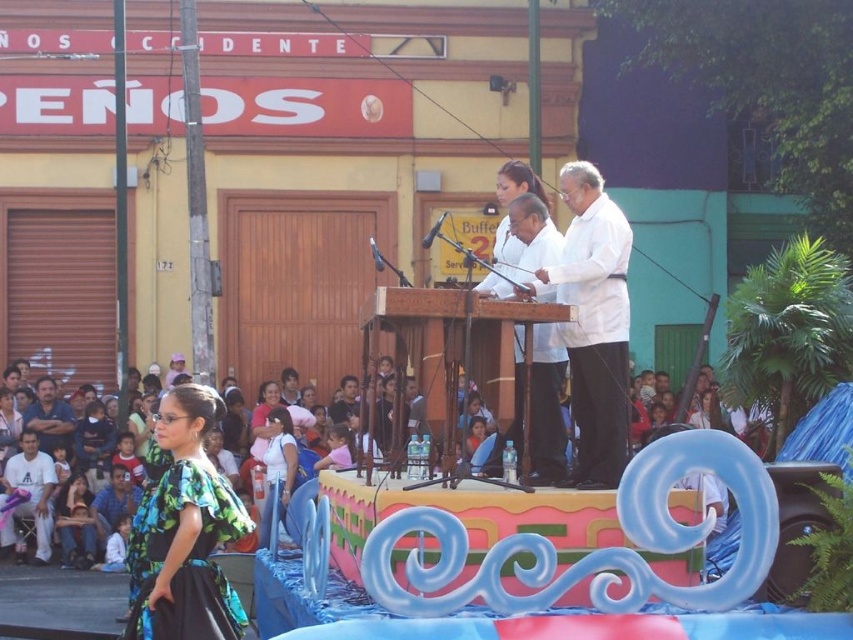
The width and height of the screenshot is (853, 640). Identify the location of floral dress at lower left. 76,525.

Looking at this image, who is taller, floral dress at lower left or dark brown leather jacket at lower left?

floral dress at lower left is taller.

What do you see at coordinates (76, 525) in the screenshot? I see `floral dress at lower left` at bounding box center [76, 525].

The image size is (853, 640). In order to click on floral dress at lower left in this screenshot , I will do `click(76, 525)`.

Is the position of matte white blouse at center more distant than that of white cotton shirt at center?

That is False.

Is point (492, 285) farther from viewer compared to point (267, 493)?

No, it is not.

This screenshot has height=640, width=853. What are the coordinates of `matte white blouse at center` in the screenshot? It's located at (546, 412).

Does point (152, 576) come closer to viewer compared to point (350, 509)?

Yes.

Between point (213, 579) and point (730, 529), which one is positioned in front?

Positioned in front is point (213, 579).

Who is more forward, (218, 406) or (480, 518)?

Positioned in front is point (480, 518).

I want to click on green floral dress at lower left, so click(x=184, y=531).